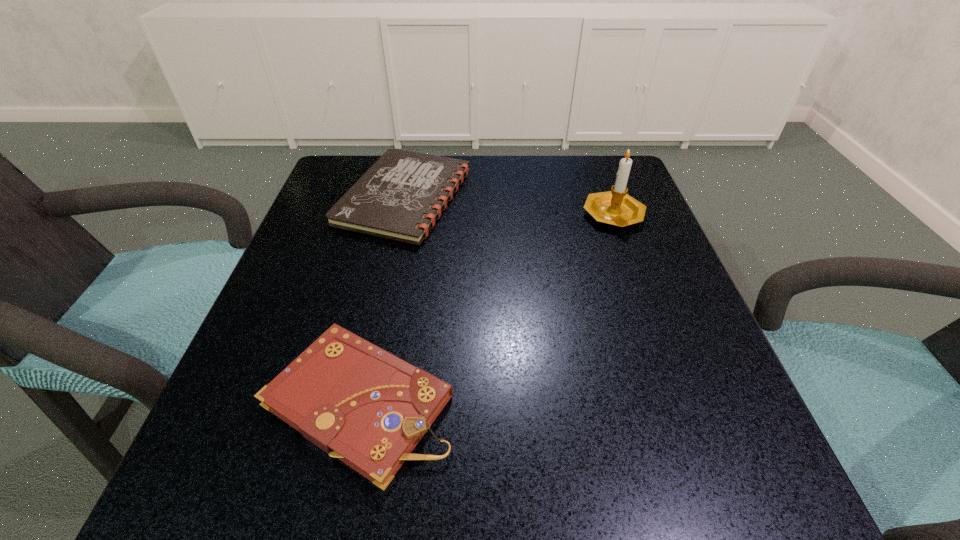
Locate an element on the screen. object that is at the near edge is located at coordinates (357, 402).

The width and height of the screenshot is (960, 540). Identify the location of object present at the right edge. (615, 207).

Locate an element on the screen. This screenshot has width=960, height=540. object located at the far left corner is located at coordinates (400, 197).

Identify the location of object positioned at the near left corner. (357, 402).

Identify the location of object that is at the far right corner. Image resolution: width=960 pixels, height=540 pixels. (615, 207).

This screenshot has width=960, height=540. In the image, there is a desktop. Find the location of `vacant space at the far edge`. vacant space at the far edge is located at coordinates (535, 169).

In order to click on blank space at the near edge in this screenshot , I will do `click(397, 474)`.

At what (x,y) coordinates should I click in order to perform the action: click on vacant space at the right edge of the desktop. Please return your answer as a coordinate pair (x, y). Looking at the image, I should click on (630, 421).

The image size is (960, 540). I want to click on free space at the far left corner of the desktop, so click(339, 163).

The image size is (960, 540). Identify the location of vacant space at the far right corner of the desktop. (576, 206).